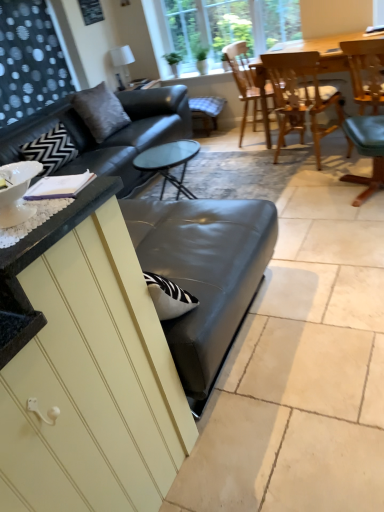
Question: Is point (377, 173) positioned closer to the camera than point (324, 95)?

Choices:
 (A) farther
 (B) closer

Answer: (B)

Question: From the image's perspective, is wooden chair at upper right, which ranks as the third chair in left-to-right order, above or below wooden chair at upper right, which is counted as the 2th chair, starting from the left?

Choices:
 (A) above
 (B) below

Answer: (A)

Question: Which of these objects is positioned farthest from the checkered fabric bar stool at center?

Choices:
 (A) wooden chair at upper center, which is the third chair in right-to-left order
 (B) gray fabric pillow at upper left
 (C) wooden chair at upper right, which ranks as the third chair in left-to-right order
 (D) clear glass window at upper center
 (E) wooden chair at upper right, which is counted as the 2th chair, starting from the left

Answer: (C)

Question: Which of these objects is positioned farthest from the gray fabric pillow at upper left?

Choices:
 (A) wooden chair at upper right, which ranks as the third chair in left-to-right order
 (B) wooden chair at upper right, which is counted as the 2th chair, starting from the left
 (C) wooden chair at upper center, which is the third chair in right-to-left order
 (D) checkered fabric bar stool at center
 (E) clear glass window at upper center

Answer: (A)